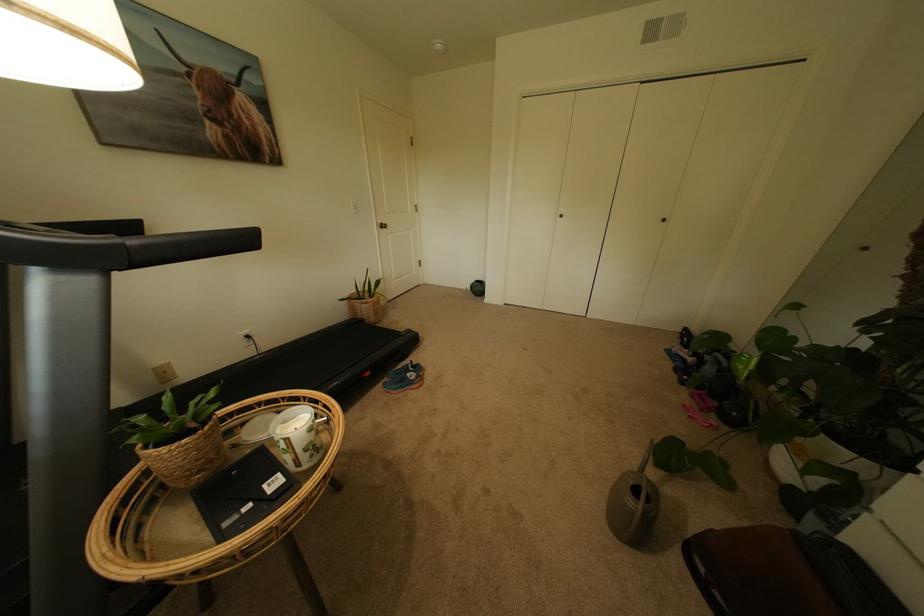
Find where to grip the treadmill handle. Please return your answer as a coordinate pair (x, y).

(189, 246)